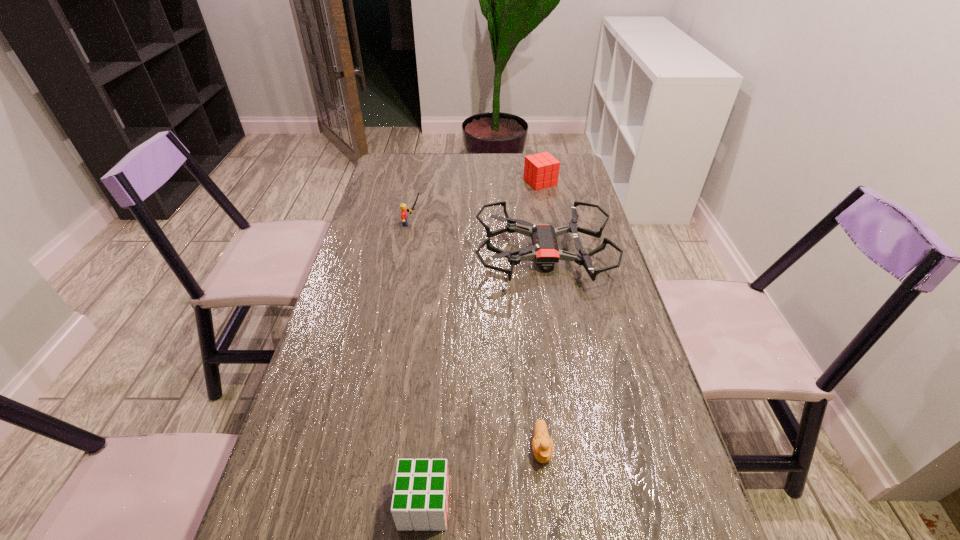
Where is `the leftmost object`? Image resolution: width=960 pixels, height=540 pixels. the leftmost object is located at coordinates (404, 210).

You are a GUI agent. You are given a task and a screenshot of the screen. Output one action in this format:
    pyautogui.click(x=<x>, y=<y>)
    Task: Click on the farthest object
    The height and width of the screenshot is (540, 960).
    Given the screenshot: What is the action you would take?
    pos(541,170)

This screenshot has height=540, width=960. Find the location of `the farther cube`. the farther cube is located at coordinates (541, 170).

The width and height of the screenshot is (960, 540). I want to click on the left cube, so click(420, 500).

Where is `the second object from left to right`? This screenshot has height=540, width=960. the second object from left to right is located at coordinates tap(420, 500).

What are the coordinates of `drone` in the screenshot? It's located at (545, 251).

Where is `the second nearest object`? The width and height of the screenshot is (960, 540). the second nearest object is located at coordinates (543, 447).

Locate an element on the screen. duckling is located at coordinates (543, 447).

Locate an element on the screen. vacant space situated on the front-facing side of the Lego is located at coordinates (475, 224).

At what (x,y) coordinates should I click in order to perform the action: click on free point located on the front of the right cube. Please return your answer as a coordinate pair (x, y). Looking at the image, I should click on (543, 198).